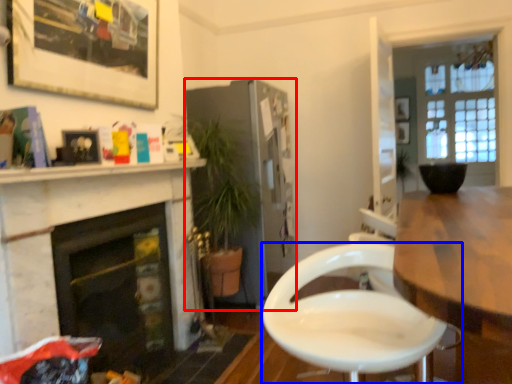
Question: Which point is closer to the camera, cabinetry (highlighted by a red box) or chair (highlighted by a blue box)?

Choices:
 (A) cabinetry
 (B) chair

Answer: (B)